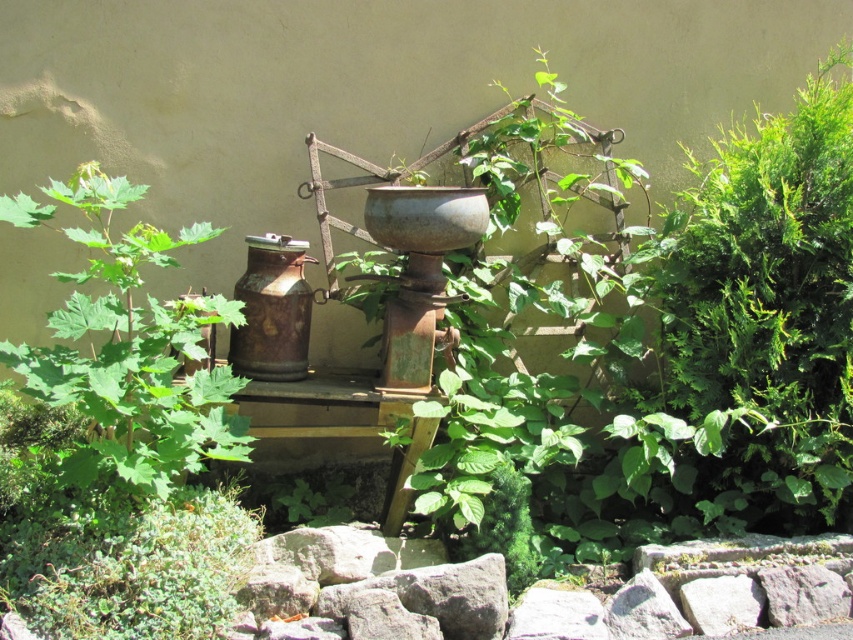
Consider the image. You are standing in front of the wooden shelf with the vintage metal scale and milk churn. To your left, there is a green leafy plant at left, and to your right, a green leafy bush at right. Which of these plants is located to the right side of the other?

The green leafy bush at right is positioned on the right side of the green leafy plant at left.

You are a gardener who wants to water both the green leafy bush at right and the green leafy plant at left. If you are standing at the center of the shelf, which direction should you move to reach the farther one first?

The green leafy bush at right is 2.08 meters away from the green leafy plant at left. Since you are standing at the center of the shelf, the farther one would be the green leafy bush at right. Move towards the right to reach it first.

You are trying to determine if the green leafy bush at right and the green leafy plant at left can both fit on a new shelf that is 1.2 meters wide. Based on their widths, can they both fit together?

The green leafy bush at right might be wider than the green leafy plant at left, so their combined width could exceed 1.2 meters. It is uncertain if they will both fit together.